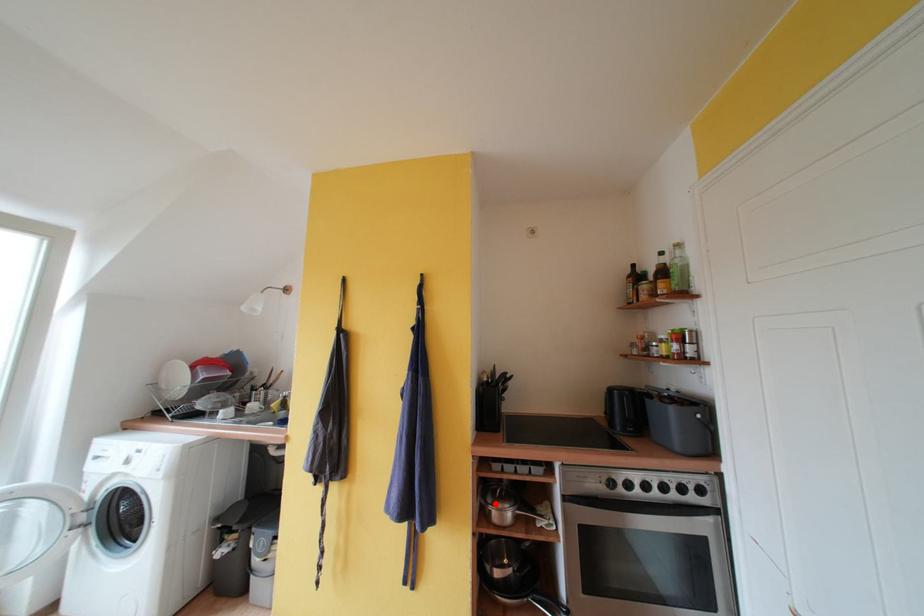
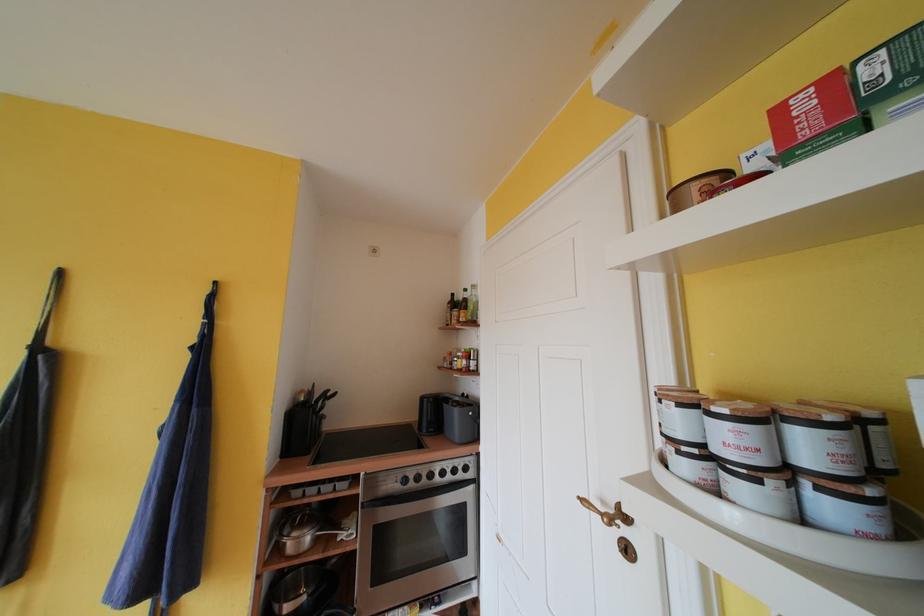
Question: I am providing you with two images of the same scene from different viewpoints. A red point is shown in image1. For the corresponding object point in image2, is it positioned nearer or farther from the camera?

Choices:
 (A) Nearer
 (B) Farther

Answer: (A)